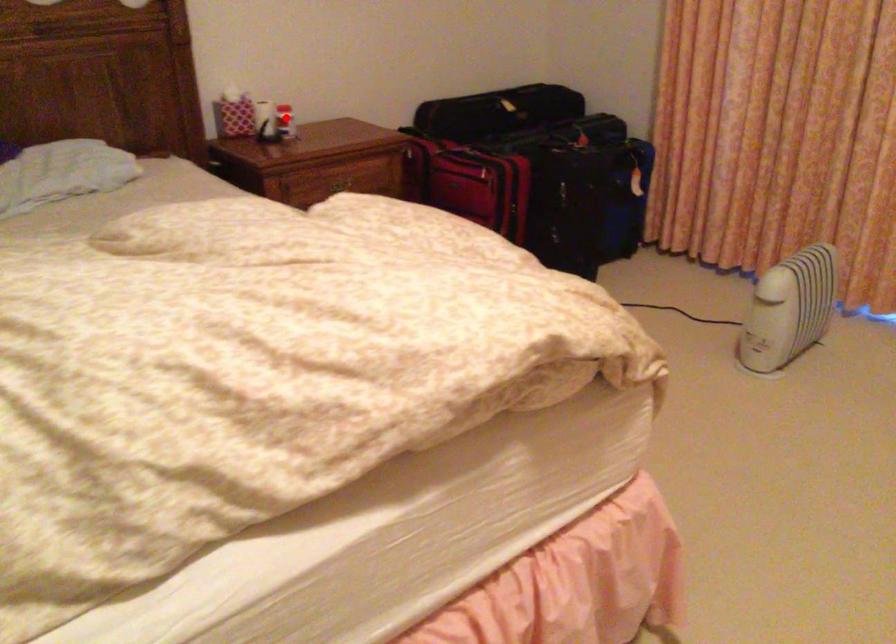
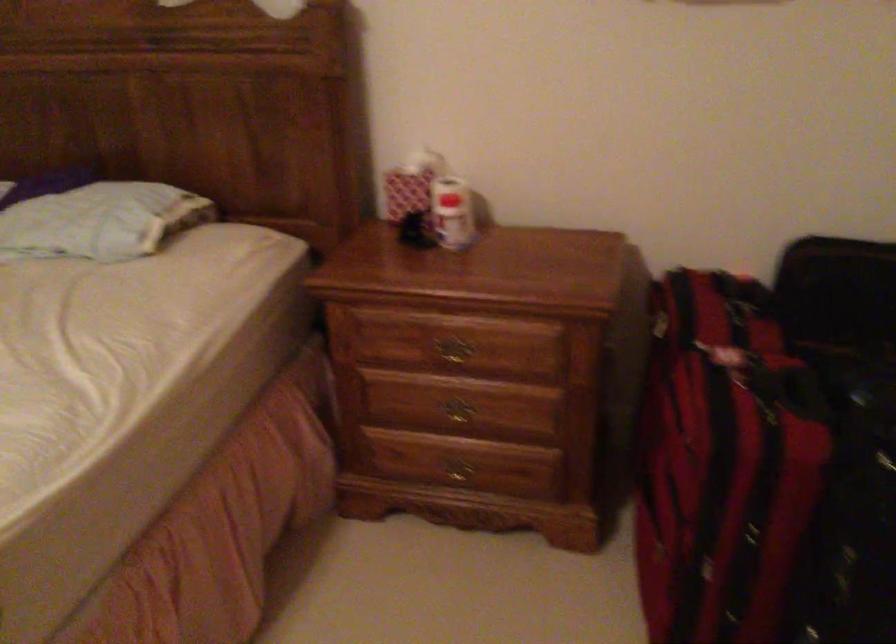
Question: I am providing you with two images of the same scene from different viewpoints. Image1 has a red point marked. In image2, the corresponding 3D location appears at what relative position? Reply with the corresponding letter.

Choices:
 (A) Closer
 (B) Farther

Answer: (A)